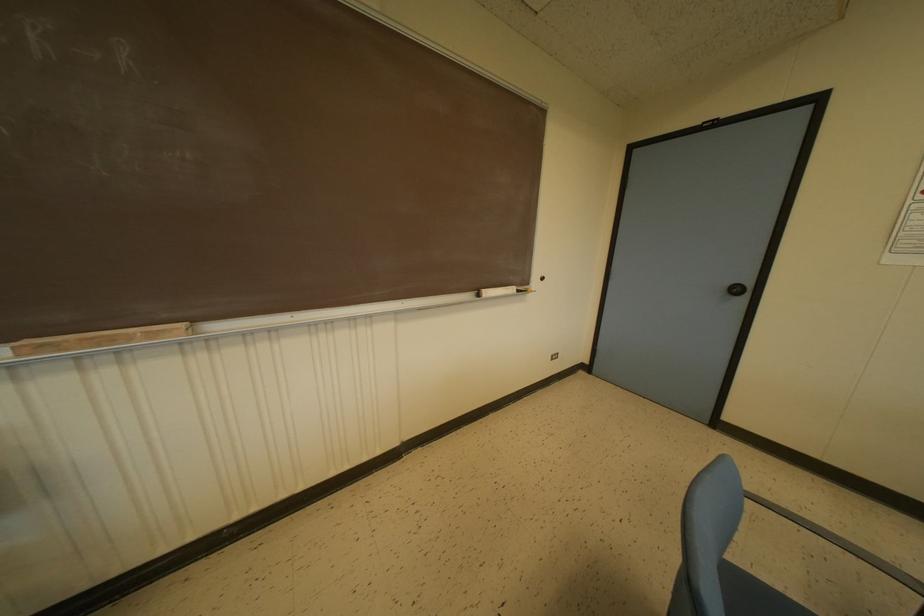
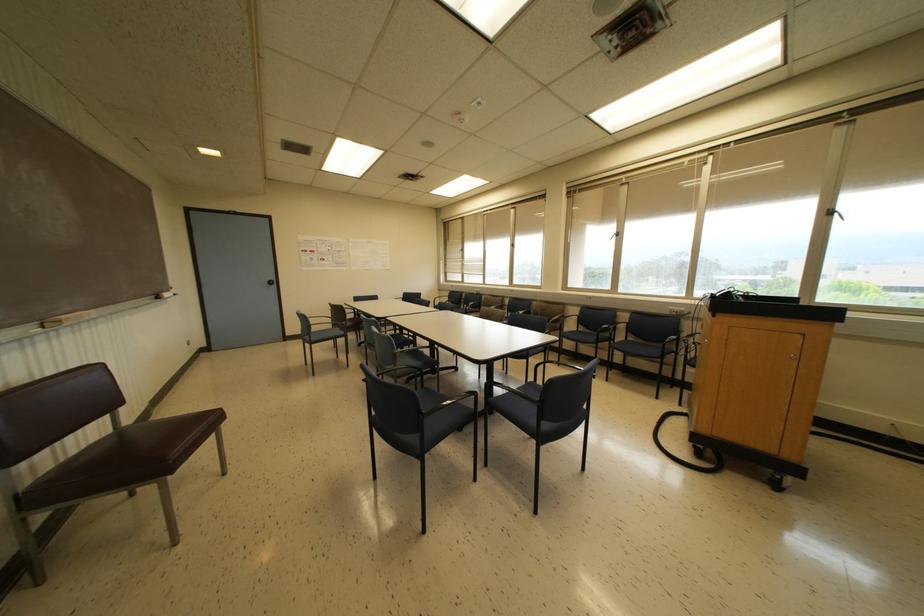
Where in the second image is the point corresponding to point (746, 291) from the first image?

(274, 282)